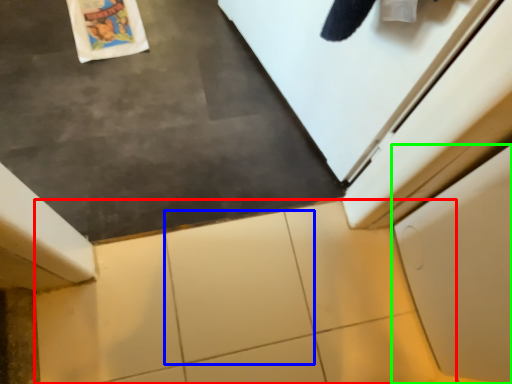
Question: Based on their relative distances, which object is farther from tile (highlighted by a red box)? Choose from granite (highlighted by a blue box) and cabinetry (highlighted by a green box).

Choices:
 (A) granite
 (B) cabinetry

Answer: (B)